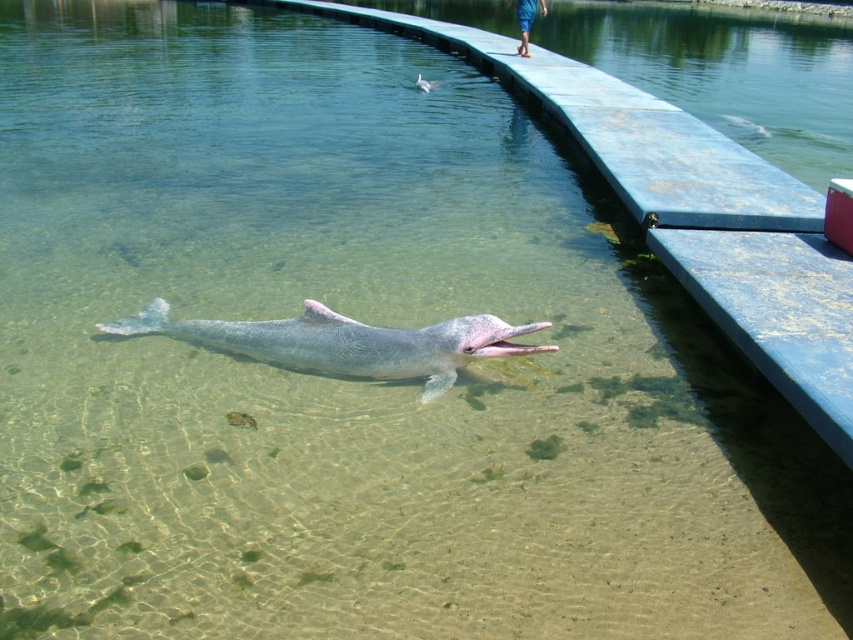
Which is below, gray matte dolphin at center or pink rubber dolphin at center?

Positioned lower is gray matte dolphin at center.

Can you confirm if gray matte dolphin at center is smaller than pink rubber dolphin at center?

No, gray matte dolphin at center is not smaller than pink rubber dolphin at center.

Which is in front, point (314, 371) or point (427, 92)?

Point (314, 371) is more forward.

The width and height of the screenshot is (853, 640). Find the location of `gray matte dolphin at center`. gray matte dolphin at center is located at coordinates (346, 342).